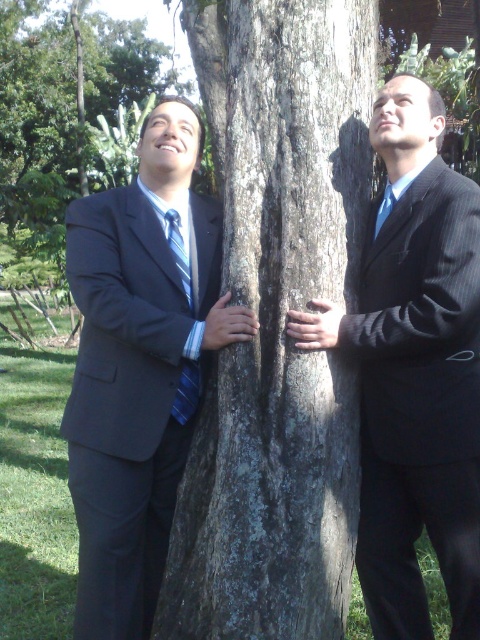
Which is in front, point (162, 326) or point (175, 221)?

Positioned in front is point (162, 326).

Which of these two, matte black suit at left or blue striped tie at left, stands taller?

matte black suit at left is taller.

Who is more forward, [190,259] or [196,278]?

Positioned in front is point [196,278].

Locate an element on the screen. The width and height of the screenshot is (480, 640). matte black suit at left is located at coordinates (140, 365).

Between pinstripe suit at center and blue silk tie at right, which one appears on the right side from the viewer's perspective?

blue silk tie at right is more to the right.

How distant is pinstripe suit at center from blue silk tie at right?

pinstripe suit at center and blue silk tie at right are 20.47 inches apart.

Is point (397, 378) positioned before point (387, 189)?

Yes, point (397, 378) is in front of point (387, 189).

What are the coordinates of `pinstripe suit at center` in the screenshot? It's located at (415, 372).

Where is `pinstripe suit at center`? This screenshot has height=640, width=480. pinstripe suit at center is located at coordinates (415, 372).

Does pinstripe suit at center appear on the right side of dark brown textured bark at center?

Indeed, pinstripe suit at center is positioned on the right side of dark brown textured bark at center.

Which is behind, point (441, 323) or point (96, 35)?

Point (96, 35)

This screenshot has height=640, width=480. I want to click on pinstripe suit at center, so click(x=415, y=372).